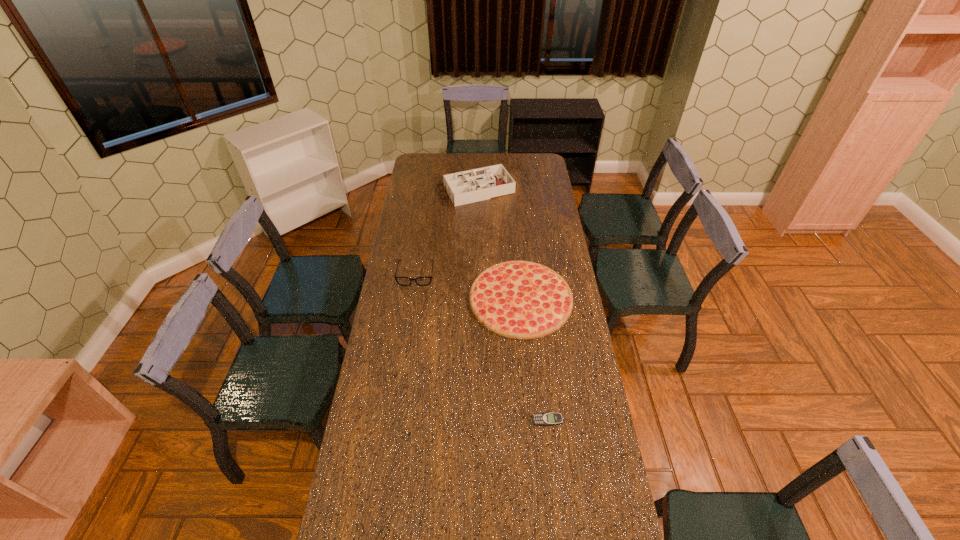
At what (x,y) coordinates should I click in order to perform the action: click on vacant region that satisfies the following two spatial constraints: 1. on the front-facing side of the shortest object; 2. on the left side of the second tallest object. Please return your answer as a coordinate pair (x, y). The width and height of the screenshot is (960, 540). Looking at the image, I should click on (395, 420).

Locate an element on the screen. This screenshot has width=960, height=540. free space in the image that satisfies the following two spatial constraints: 1. on the front side of the tallest object; 2. on the right side of the beeper is located at coordinates (474, 420).

You are a GUI agent. You are given a task and a screenshot of the screen. Output one action in this format:
    pyautogui.click(x=<x>, y=<y>)
    Task: Click on the vacant space that satisfies the following two spatial constraints: 1. on the front-facing side of the spectacles; 2. on the right side of the pizza
    
    Given the screenshot: What is the action you would take?
    pyautogui.click(x=413, y=299)

What are the coordinates of `vacant space that satisfies the following two spatial constraints: 1. on the front-facing side of the second tallest object; 2. on the right side of the beeper` in the screenshot? It's located at (395, 420).